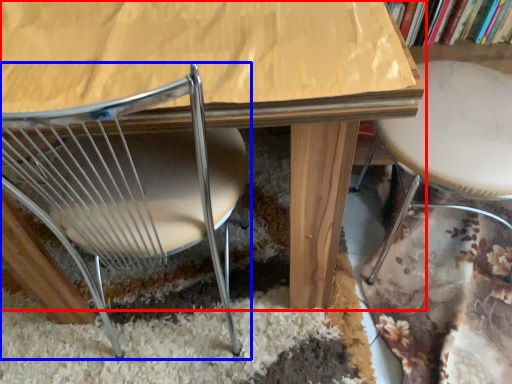
Question: Which point is closer to the camera, table (highlighted by a red box) or chair (highlighted by a blue box)?

Choices:
 (A) table
 (B) chair

Answer: (B)